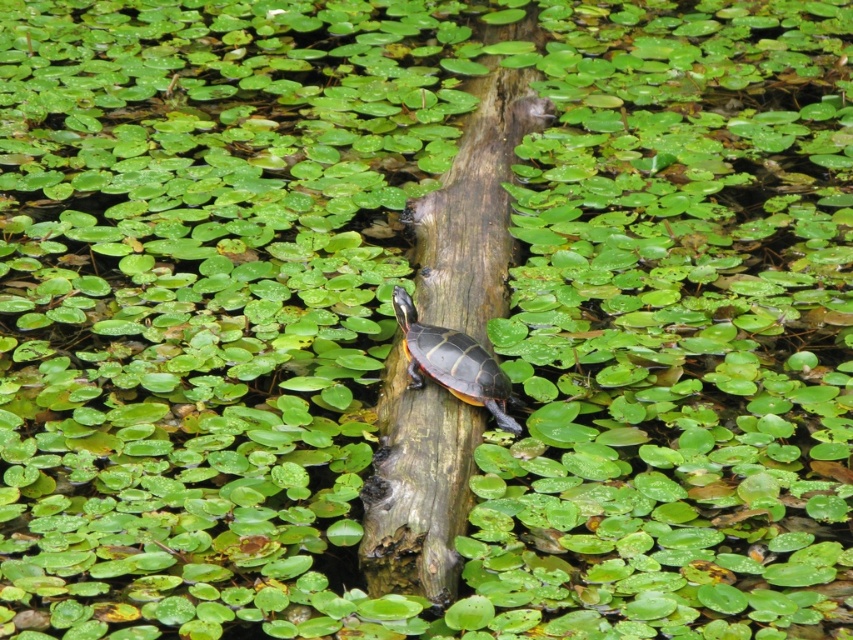
You are a photographer trying to capture the turtle on the brown rough wood at center. To ensure the turtle is in the frame, where should you aim your camera? Please provide coordinates based on the image grid where the center is at point 0.5, 0.5 and the range is from 0 to 1 in both x and y axes.

The turtle is on the brown rough wood at center, which is located at coordinates (416,486). Aim your camera at this point to capture the turtle.

You are a small frog trying to jump from the shiny brown tortoise at center to the brown rough wood at center. Can you make the jump if your maximum jump distance is 20 inches?

The brown rough wood at center is 24.06 inches from the shiny brown tortoise at center, so the frog cannot make the jump since its maximum jump distance is 20 inches.

From the picture: You are a photographer trying to capture the turtle on the log. Since the turtle is on the brown rough wood at center, which is taller than the shiny brown tortoise at center, how might the turtle appear in the photo compared to the log?

The brown rough wood at center is taller than the shiny brown tortoise at center, so the turtle will appear smaller in the photo compared to the log.